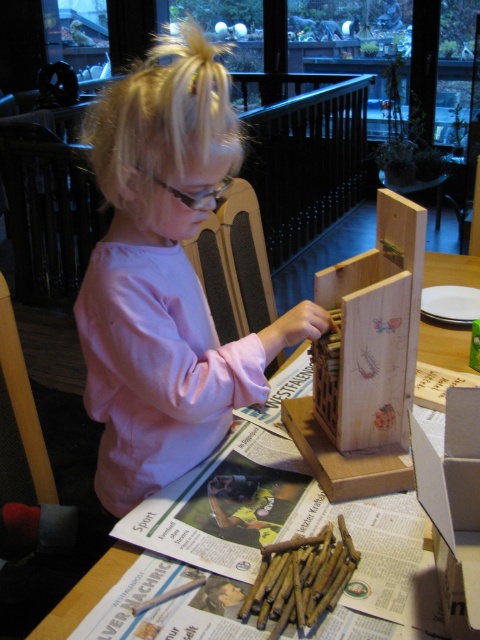
Question: Which object appears farthest from the camera in this image?

Choices:
 (A) wooden box at center
 (B) wooden pencils at center
 (C) wooden table at center
 (D) pink matte shirt at center

Answer: (C)

Question: Which object is closer to the camera taking this photo?

Choices:
 (A) pink matte shirt at center
 (B) wooden table at center
 (C) wooden box at center

Answer: (A)

Question: Which of the following is the farthest from the observer?

Choices:
 (A) (261, 563)
 (B) (305, 337)
 (C) (357, 432)

Answer: (C)

Question: Does wooden box at center appear over wooden pencils at center?

Choices:
 (A) no
 (B) yes

Answer: (B)

Question: Does pink matte shirt at center appear under wooden table at center?

Choices:
 (A) yes
 (B) no

Answer: (A)

Question: Is wooden box at center bigger than wooden table at center?

Choices:
 (A) no
 (B) yes

Answer: (B)